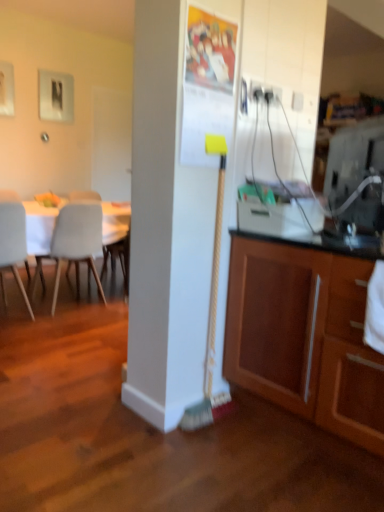
Image resolution: width=384 pixels, height=512 pixels. I want to click on free space in front of yellow-bristled broom at center, so click(x=208, y=444).